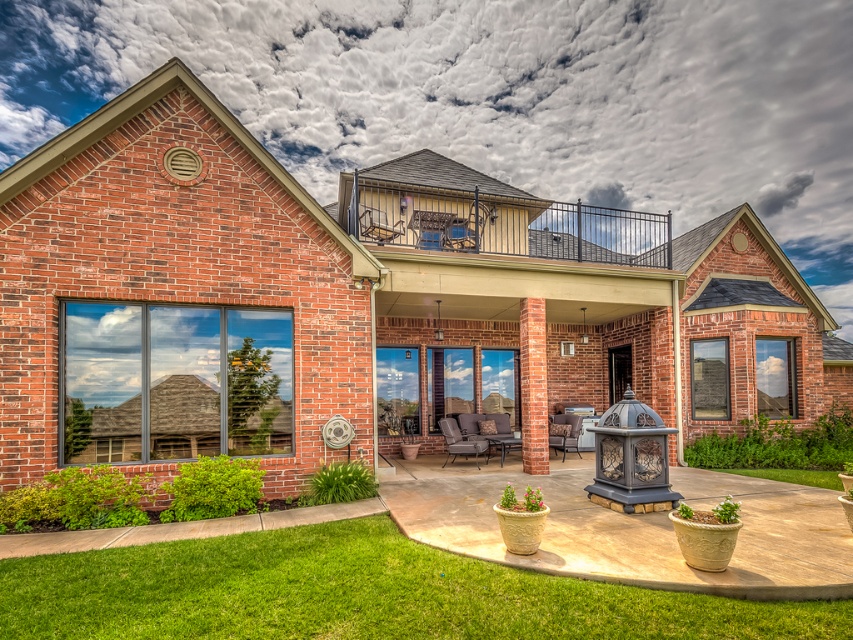
Question: Can you confirm if green grass at lower left is thinner than metallic lantern at center?

Choices:
 (A) no
 (B) yes

Answer: (A)

Question: Among these points, which one is nearest to the camera?

Choices:
 (A) (624, 477)
 (B) (699, 604)

Answer: (B)

Question: Is green grass at lower left wider than metallic lantern at center?

Choices:
 (A) yes
 (B) no

Answer: (A)

Question: Can you confirm if green grass at lower left is smaller than metallic lantern at center?

Choices:
 (A) yes
 (B) no

Answer: (A)

Question: Which point is farther from the camera taking this photo?

Choices:
 (A) (451, 592)
 (B) (637, 426)

Answer: (B)